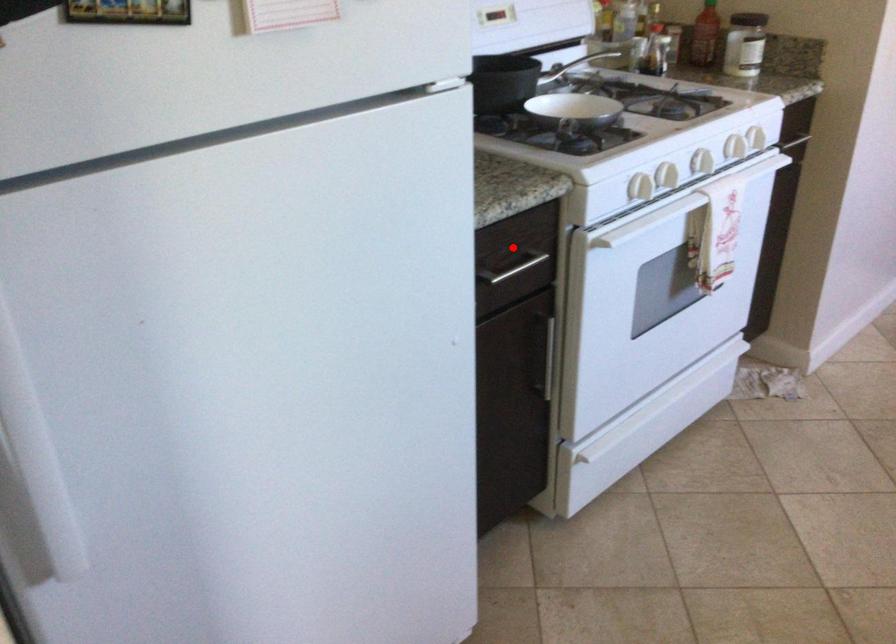
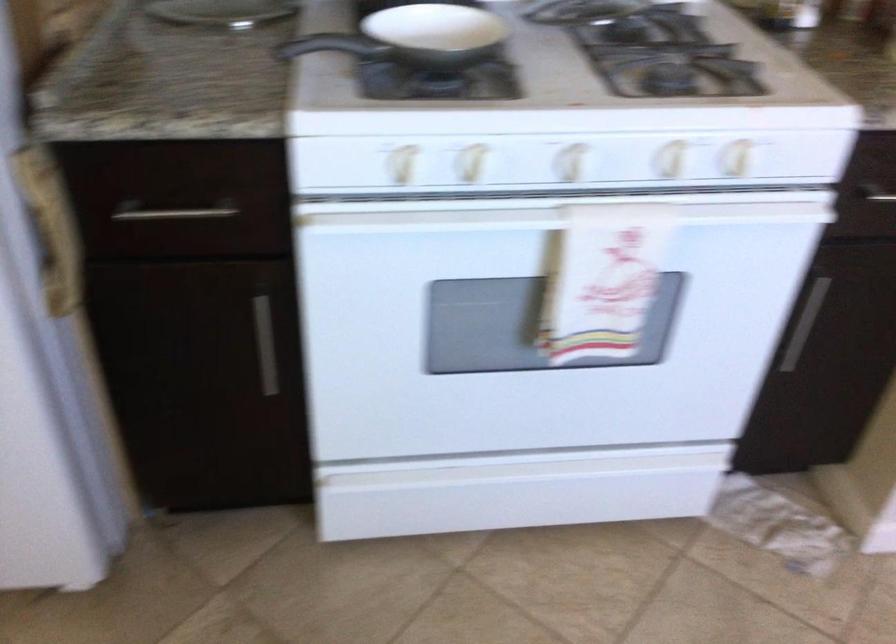
Question: A red point is marked in image1. In image2, is the corresponding 3D point closer to the camera or farther? Reply with the corresponding letter.

Choices:
 (A) The corresponding 3D point is closer.
 (B) The corresponding 3D point is farther.

Answer: (A)